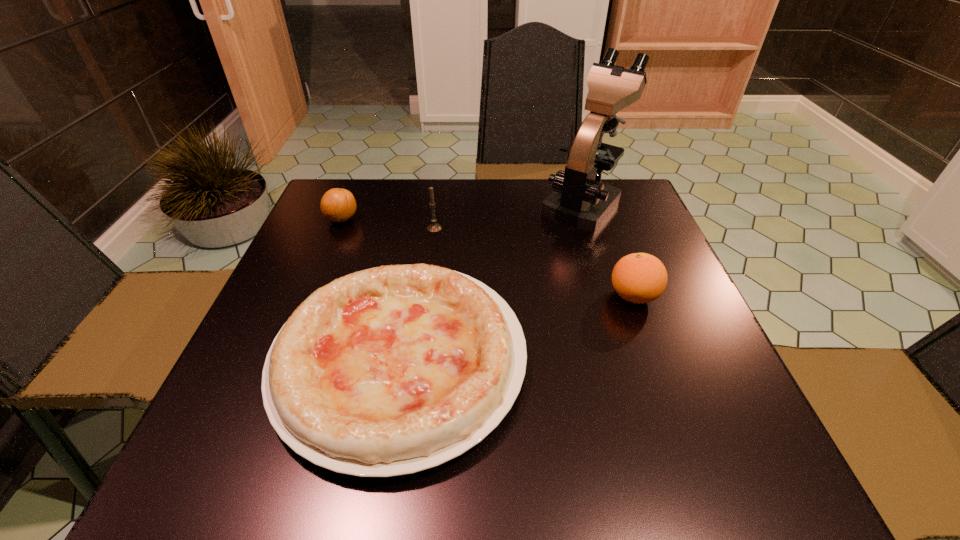
Locate an element on the screen. This screenshot has width=960, height=540. object positioned at the far left corner is located at coordinates (338, 205).

This screenshot has height=540, width=960. I want to click on object located in the near left corner section of the desktop, so click(x=392, y=370).

Locate an element on the screen. object at the far right corner is located at coordinates (580, 200).

Locate an element on the screen. vacant region at the far edge of the desktop is located at coordinates tap(511, 192).

Identify the location of vacant space at the near edge. (597, 449).

Find the location of a particular element. The width and height of the screenshot is (960, 540). vacant space at the left edge of the desktop is located at coordinates (257, 375).

This screenshot has height=540, width=960. Identify the location of free space at the right edge. (693, 360).

At what (x,y) coordinates should I click in order to perform the action: click on vacant space at the near left corner of the desktop. Please return your answer as a coordinate pair (x, y). The width and height of the screenshot is (960, 540). Looking at the image, I should click on (287, 490).

Identify the location of vacant space at the far right corner of the desktop. Image resolution: width=960 pixels, height=540 pixels. (643, 211).

Where is `empty location between the tallest object and the candle`? This screenshot has height=540, width=960. empty location between the tallest object and the candle is located at coordinates (509, 216).